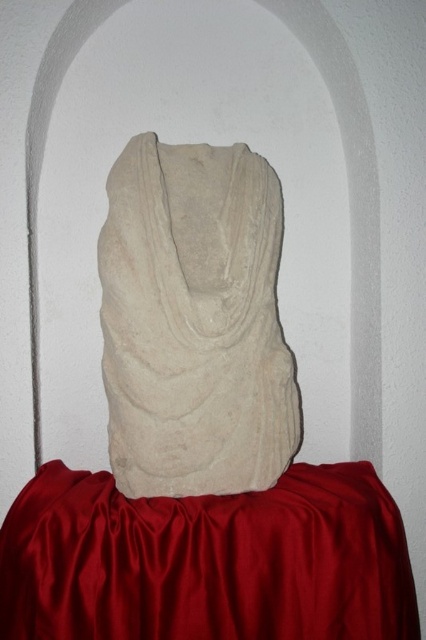
Is satin red tablecloth at center above white stone bust at center?

No, satin red tablecloth at center is not above white stone bust at center.

Between point (181, 612) and point (224, 246), which one is positioned in front?

Positioned in front is point (181, 612).

Which is behind, point (339, 577) or point (141, 433)?

The point (141, 433) is more distant.

Where is `satin red tablecloth at center`? This screenshot has height=640, width=426. satin red tablecloth at center is located at coordinates (207, 561).